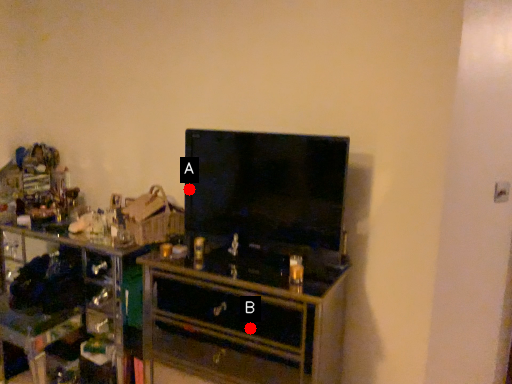
Question: Two points are circled on the image, labeled by A and B beside each circle. Which of the following is the farthest from the observer?

Choices:
 (A) A is further
 (B) B is further

Answer: (A)